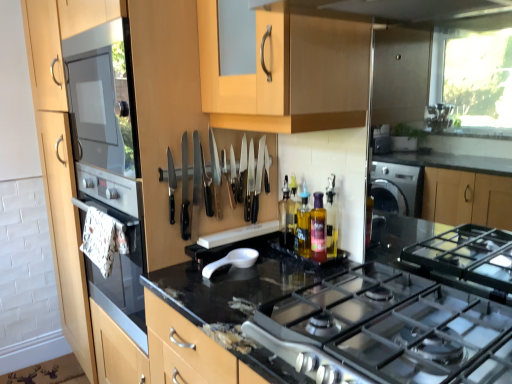
Locate an element on the screen. This screenshot has width=512, height=384. vacant region to the left of translucent plastic bottle at center, placed as the first bottle when sorted from front to back is located at coordinates (278, 270).